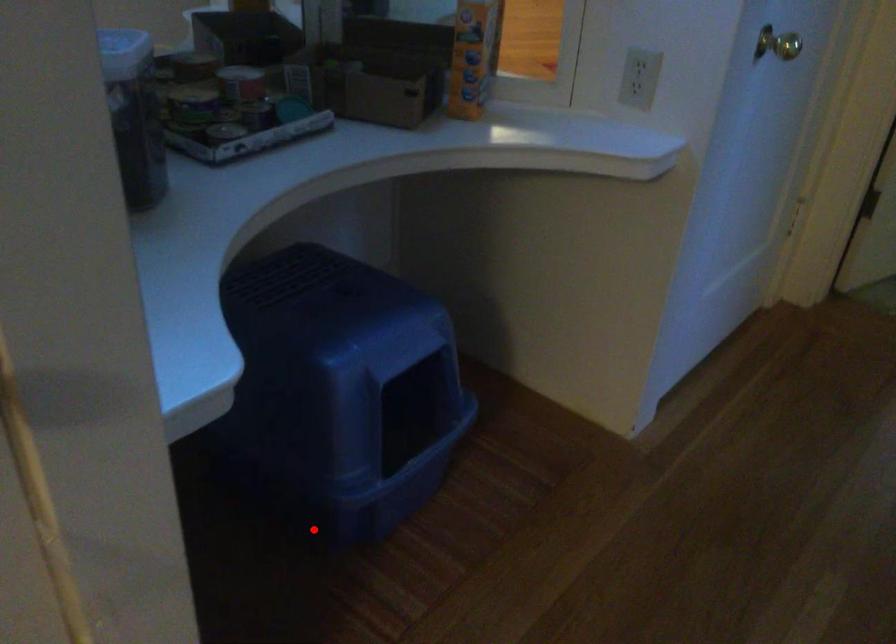
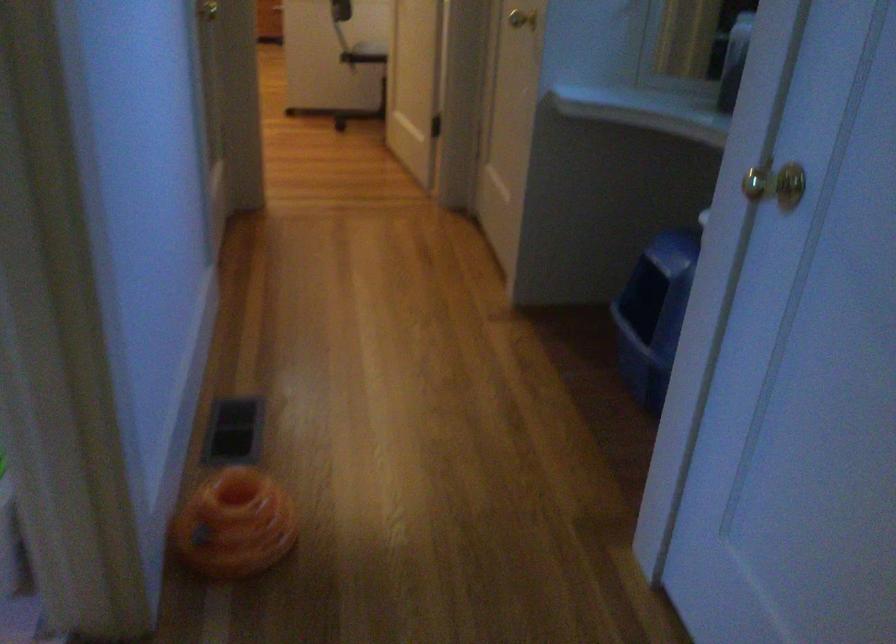
The point at the highlighted location is marked in the first image. Where is the corresponding point in the second image?

(655, 314)